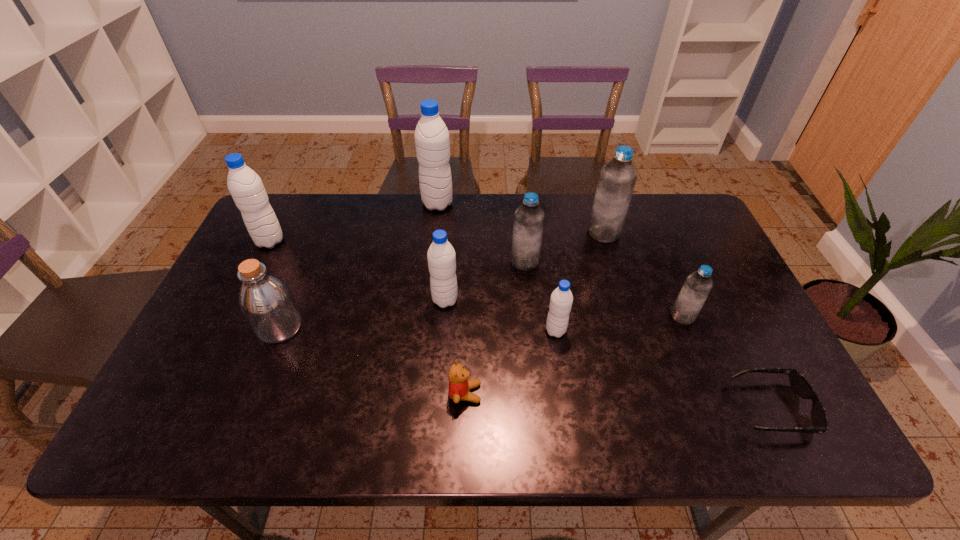
Where is `the rightmost blue water bottle`? The height and width of the screenshot is (540, 960). the rightmost blue water bottle is located at coordinates (694, 293).

What are the coordinates of `the second object from right to left` in the screenshot? It's located at (694, 293).

Locate an element on the screen. This screenshot has height=540, width=960. the smallest gray water bottle is located at coordinates point(561,300).

Where is `the rightmost gray water bottle`? Image resolution: width=960 pixels, height=540 pixels. the rightmost gray water bottle is located at coordinates (561, 300).

This screenshot has width=960, height=540. I want to click on red teddy bear, so click(x=459, y=386).

The height and width of the screenshot is (540, 960). What are the coordinates of `the second shortest object` in the screenshot? It's located at (459, 386).

The image size is (960, 540). I want to click on the shortest object, so click(x=801, y=386).

Identify the location of the rightmost object. The width and height of the screenshot is (960, 540). (801, 386).

Find the location of `vacant area located 0.240m on the right of the tallest object`. vacant area located 0.240m on the right of the tallest object is located at coordinates (522, 204).

What are the coordinates of `free space located on the left of the biggest blue water bottle` in the screenshot? It's located at (510, 233).